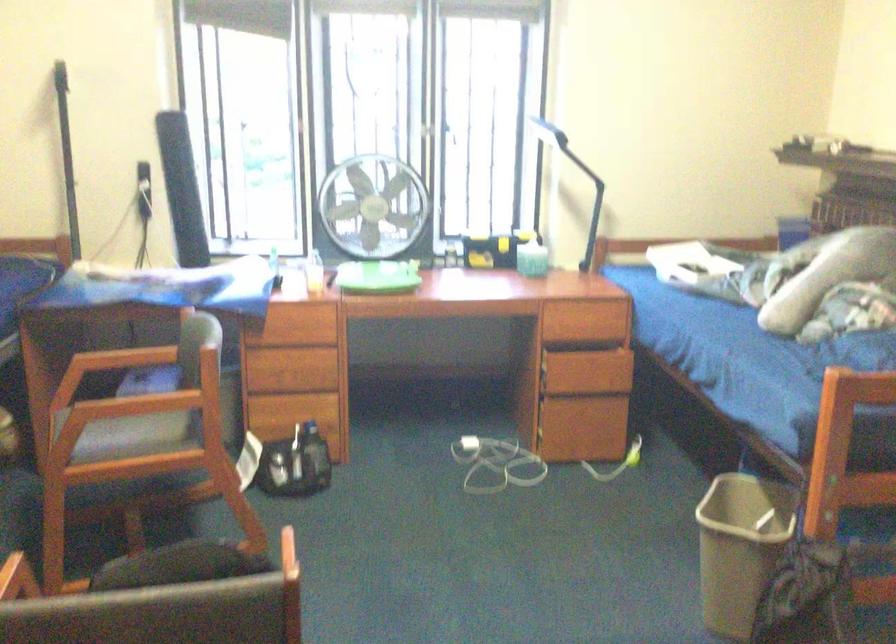
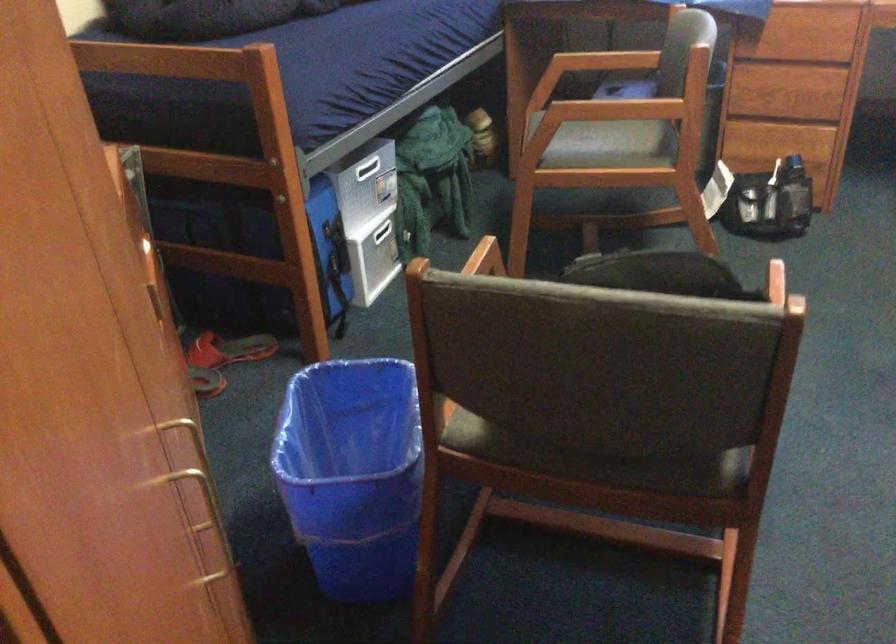
Where in the second image is the point corresponding to point (135, 436) from the first image?

(605, 145)